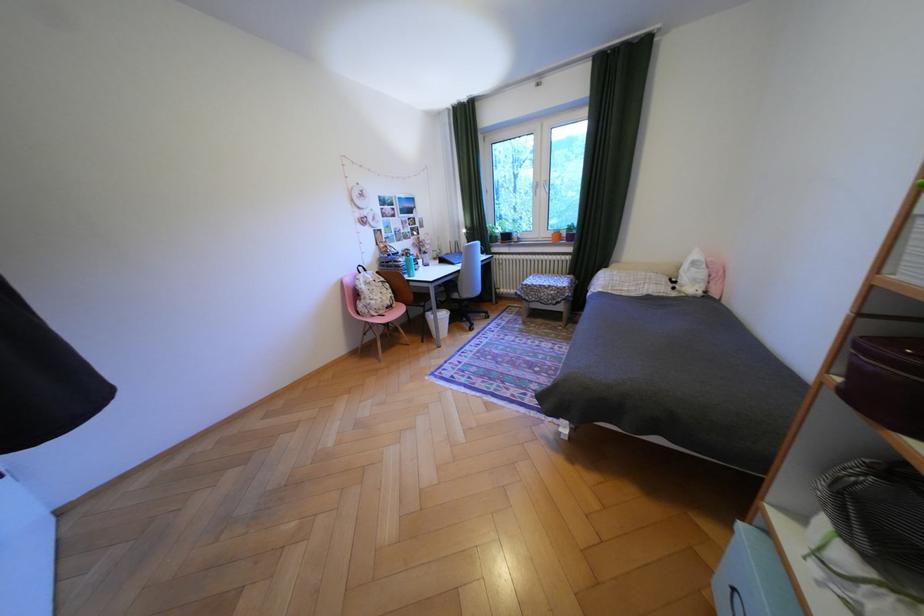
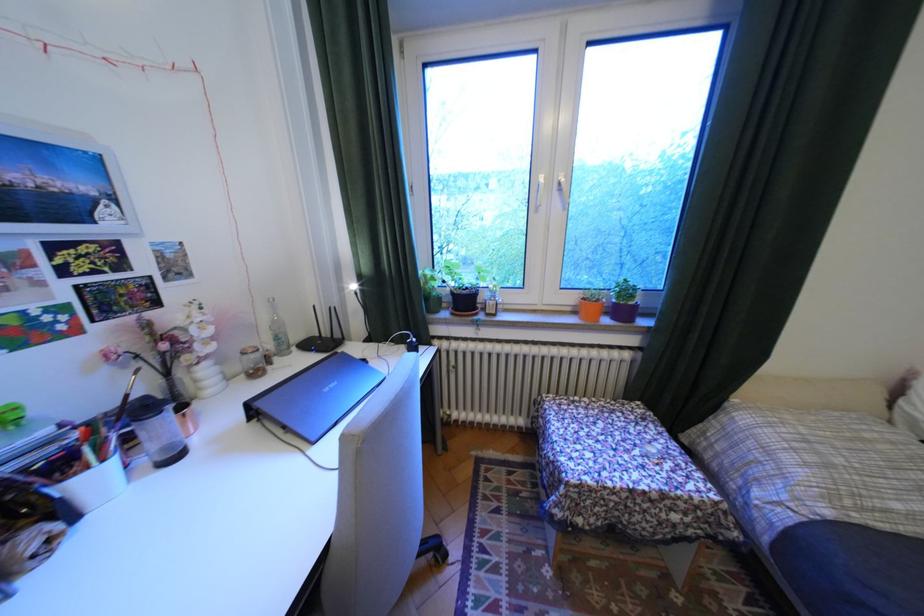
Question: In a continuous first-person perspective shot, in which direction is the camera moving?

Choices:
 (A) Left
 (B) Right
 (C) Forward
 (D) Backward

Answer: (C)